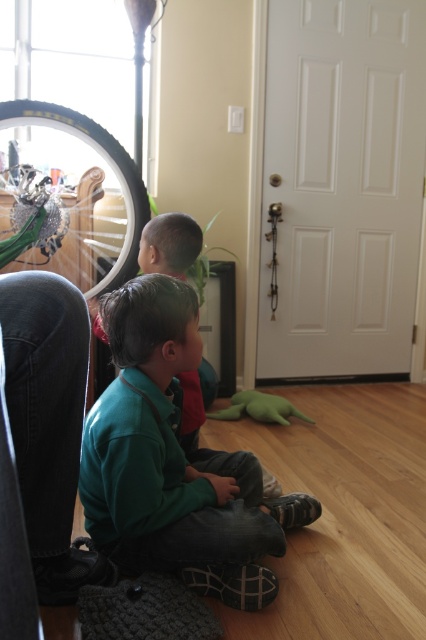
You are a delivery robot that is 1.2 meters tall. You need to deliver a package to the green plush toy at lower center, but you must avoid hitting the dark green fabric pants at lower left. Can you safely navigate to the toy without getting too close to the pants?

The dark green fabric pants at lower left is 1.42 meters away from the green plush toy at lower center. Since the robot is 1.2 meters tall, it can navigate safely as the distance between them allows enough space to avoid collision while reaching the toy.

You are a photographer trying to capture a closeup of the green plush toy at lower center without including the green soft shirt at lower left in the frame. Based on their positions, is this possible?

The green soft shirt at lower left is to the left of green plush toy at lower center, so moving the camera to the right side of the plush toy or adjusting the angle could exclude the shirt from the frame.

You are a photographer trying to capture a photo of the shiny metallic bicycle wheel at left without the green soft shirt at lower left blocking it. Based on their positions, which direction should you move the camera to the right or left to ensure the bicycle wheel is fully visible?

The green soft shirt at lower left is to the right of the shiny metallic bicycle wheel at left. To avoid the green soft shirt at lower left blocking the view, you should move the camera to the left so that the bicycle wheel is fully visible.